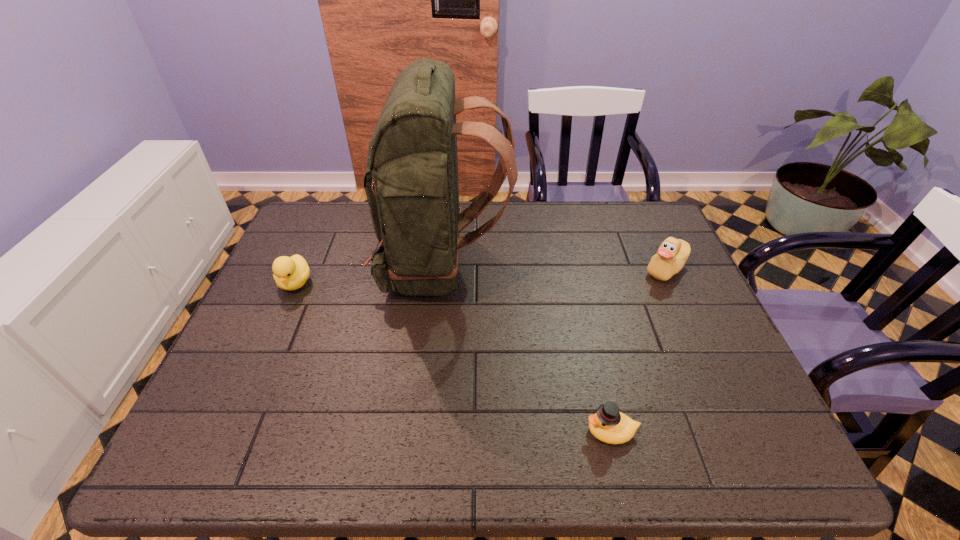
The height and width of the screenshot is (540, 960). Identify the location of vacant position located at the beak of the rightmost object. (544, 269).

This screenshot has width=960, height=540. Identify the location of vacant area located on the front-facing side of the second shortest object. (237, 414).

What are the coordinates of `vacant space situated on the front-facing side of the shortest object` in the screenshot? It's located at (403, 431).

At what (x,y) coordinates should I click in order to perform the action: click on free space located on the front-facing side of the shortest object. Please return your answer as a coordinate pair (x, y). This screenshot has width=960, height=540. Looking at the image, I should click on (476, 431).

Find the location of a particular element. vacant space located on the front-facing side of the shortest object is located at coordinates (471, 431).

You are a GUI agent. You are given a task and a screenshot of the screen. Output one action in this format:
    pyautogui.click(x=<x>, y=<y>)
    Task: Click on the object present at the far edge
    The width and height of the screenshot is (960, 540).
    Given the screenshot: What is the action you would take?
    pyautogui.click(x=411, y=182)

Locate an element on the screen. Image resolution: width=960 pixels, height=540 pixels. object present at the near edge is located at coordinates (608, 425).

Where is `object present at the left edge`? Image resolution: width=960 pixels, height=540 pixels. object present at the left edge is located at coordinates (290, 273).

You are a GUI agent. You are given a task and a screenshot of the screen. Output one action in this format:
    pyautogui.click(x=<x>, y=<y>)
    Task: Click on the object located at the right edge
    The image size is (960, 540).
    Given the screenshot: What is the action you would take?
    pyautogui.click(x=672, y=254)

Image resolution: width=960 pixels, height=540 pixels. Find the location of `vacant space at the far edge of the desktop`. vacant space at the far edge of the desktop is located at coordinates (555, 215).